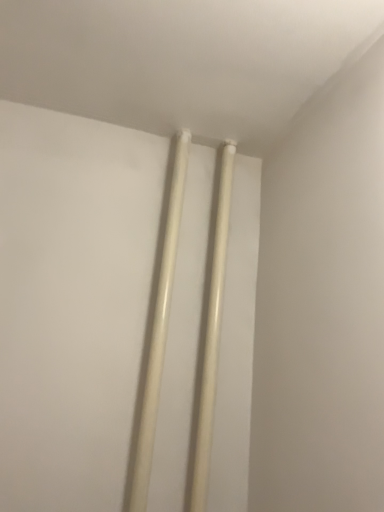
Question: Is white glossy chopsticks at center to the left of white glossy curtain rod at upper center from the viewer's perspective?

Choices:
 (A) yes
 (B) no

Answer: (A)

Question: From the image's perspective, is white glossy chopsticks at center beneath white glossy curtain rod at upper center?

Choices:
 (A) no
 (B) yes

Answer: (A)

Question: Is white glossy chopsticks at center behind white glossy curtain rod at upper center?

Choices:
 (A) no
 (B) yes

Answer: (A)

Question: From a real-world perspective, is white glossy chopsticks at center on top of white glossy curtain rod at upper center?

Choices:
 (A) no
 (B) yes

Answer: (A)

Question: Considering the relative sizes of white glossy chopsticks at center and white glossy curtain rod at upper center in the image provided, is white glossy chopsticks at center thinner than white glossy curtain rod at upper center?

Choices:
 (A) no
 (B) yes

Answer: (A)

Question: Is white glossy chopsticks at center completely or partially outside of white glossy curtain rod at upper center?

Choices:
 (A) yes
 (B) no

Answer: (A)

Question: Could you tell me if white glossy curtain rod at upper center is facing white glossy chopsticks at center?

Choices:
 (A) no
 (B) yes

Answer: (A)

Question: From the image's perspective, is white glossy curtain rod at upper center above white glossy chopsticks at center?

Choices:
 (A) no
 (B) yes

Answer: (A)

Question: Is white glossy chopsticks at center located within white glossy curtain rod at upper center?

Choices:
 (A) no
 (B) yes

Answer: (A)

Question: Is the depth of white glossy curtain rod at upper center greater than that of white glossy chopsticks at center?

Choices:
 (A) yes
 (B) no

Answer: (A)

Question: Is there a large distance between white glossy curtain rod at upper center and white glossy chopsticks at center?

Choices:
 (A) no
 (B) yes

Answer: (A)

Question: Does white glossy curtain rod at upper center have a smaller size compared to white glossy chopsticks at center?

Choices:
 (A) no
 (B) yes

Answer: (B)

Question: Is point (183, 165) positioned closer to the camera than point (228, 217)?

Choices:
 (A) closer
 (B) farther

Answer: (B)